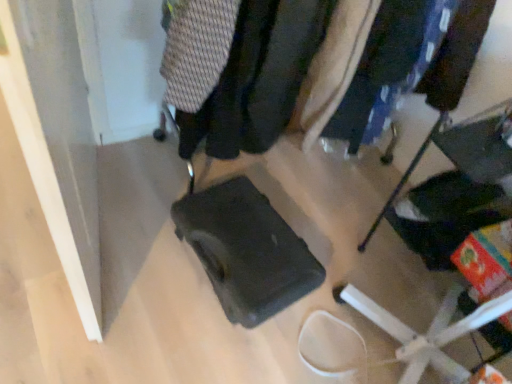
Locate an element on the screen. Image resolution: width=512 pixels, height=384 pixels. vacant space in front of matte black suitcase at center is located at coordinates (202, 291).